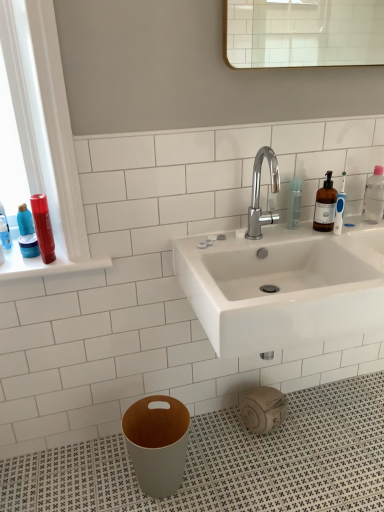
You are a GUI agent. You are given a task and a screenshot of the screen. Output one action in this format:
    pyautogui.click(x=<x>, y=<y>)
    Task: Click on the empty space that is to the right of clear plastic bottle at upper right
    The height and width of the screenshot is (512, 384).
    Given the screenshot: What is the action you would take?
    pyautogui.click(x=343, y=229)